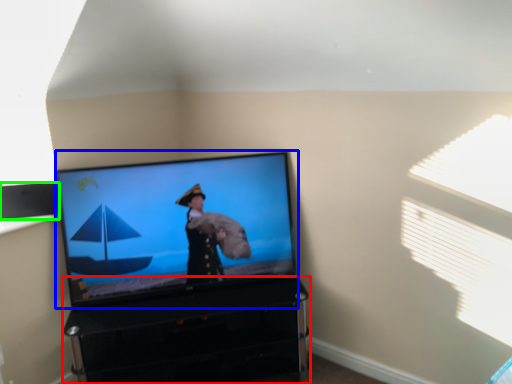
Question: Which object is the farthest from furniture (highlighted by a red box)? Choose among these: television (highlighted by a blue box) or speaker (highlighted by a green box).

Choices:
 (A) television
 (B) speaker

Answer: (B)